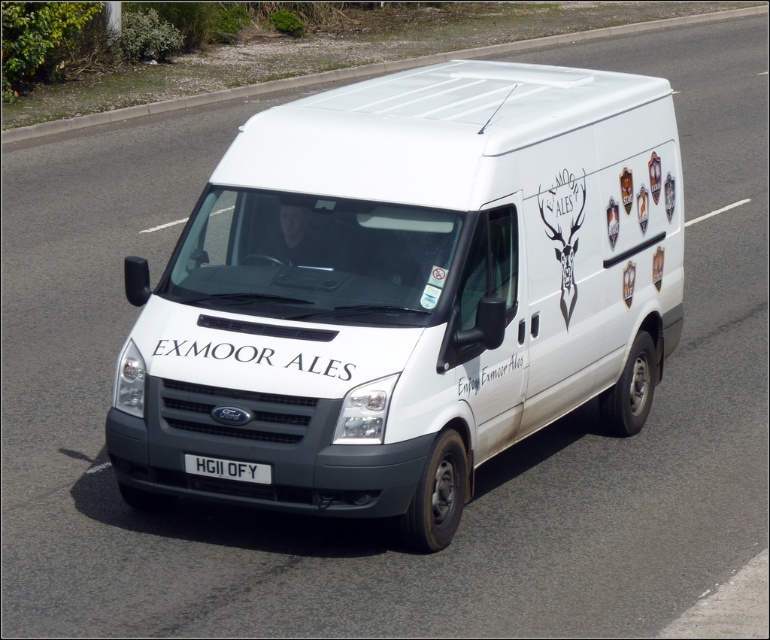
Question: Does white matte van at center appear on the left side of white plastic license plate at center?

Choices:
 (A) no
 (B) yes

Answer: (A)

Question: Is white matte van at center thinner than white plastic license plate at center?

Choices:
 (A) yes
 (B) no

Answer: (B)

Question: Does white matte van at center have a larger size compared to white plastic license plate at center?

Choices:
 (A) no
 (B) yes

Answer: (B)

Question: Among these objects, which one is nearest to the camera?

Choices:
 (A) white plastic license plate at center
 (B) white matte van at center

Answer: (B)